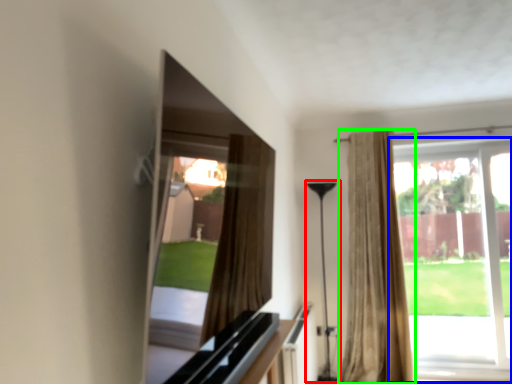
Question: Which object is positioned closest to lamp (highlighted by a red box)? Select from window (highlighted by a blue box) and curtain (highlighted by a green box).

Choices:
 (A) window
 (B) curtain

Answer: (B)